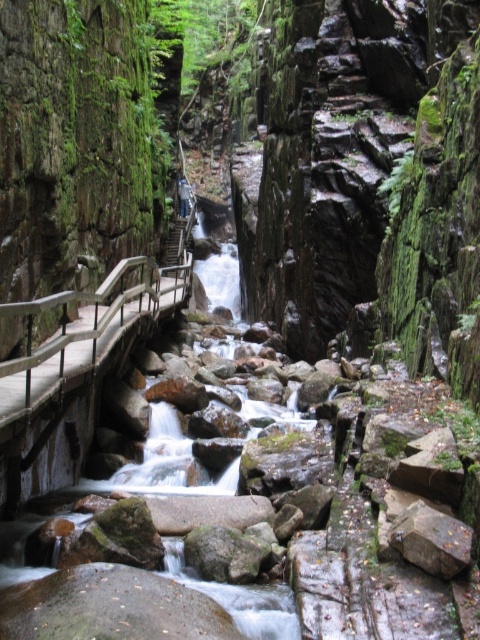
Question: Among these points, which one is nearest to the camera?

Choices:
 (A) (14, 561)
 (B) (133, 308)

Answer: (A)

Question: Is smooth gray rock stream at center closer to camera compared to wooden rail at left?

Choices:
 (A) no
 (B) yes

Answer: (B)

Question: Does smooth gray rock stream at center have a larger size compared to wooden rail at left?

Choices:
 (A) yes
 (B) no

Answer: (A)

Question: Which point is farther to the camera?

Choices:
 (A) (172, 563)
 (B) (61, 324)

Answer: (B)

Question: From the image, what is the correct spatial relationship of smooth gray rock stream at center in relation to wooden rail at left?

Choices:
 (A) below
 (B) above

Answer: (A)